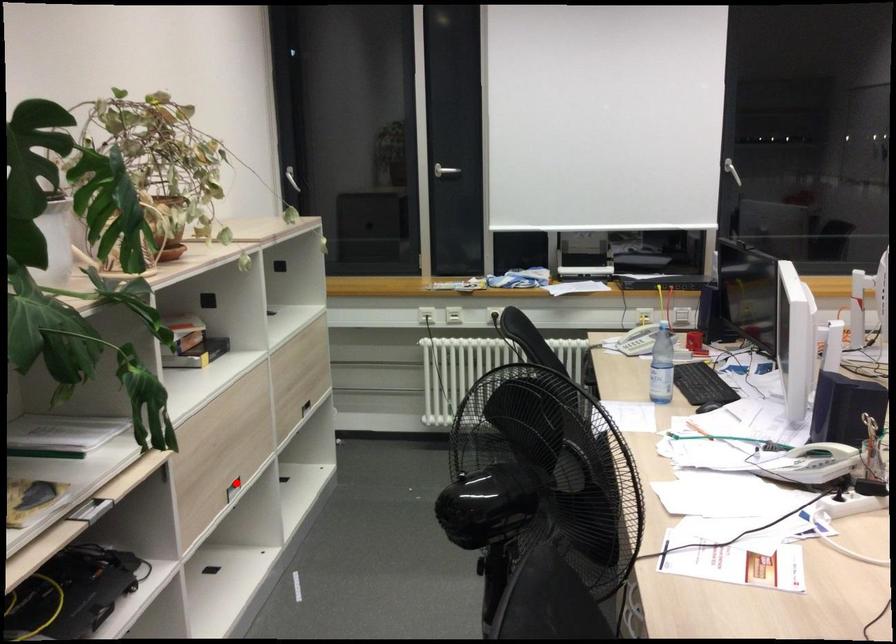
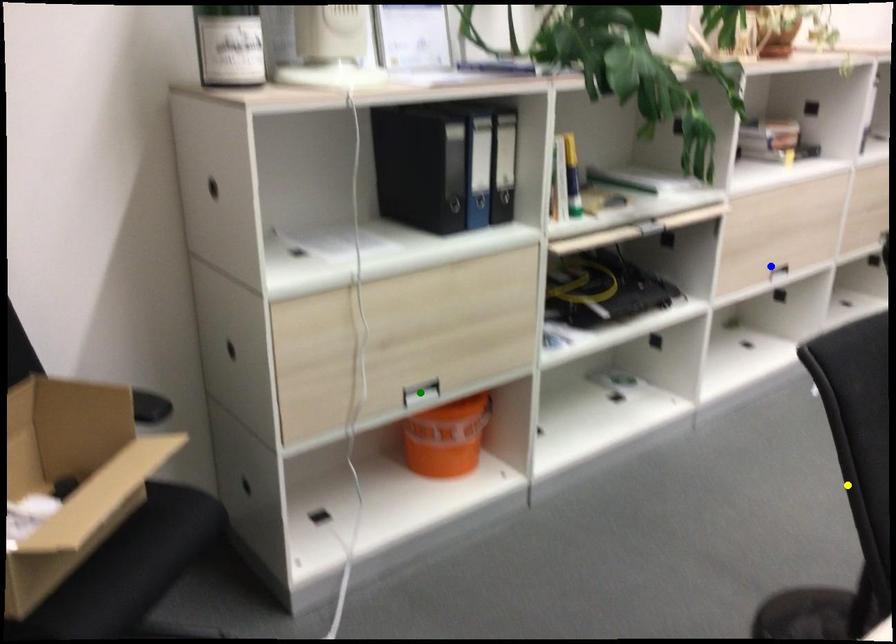
Question: I am providing you with two images of the same scene from different viewpoints. A red point is marked on the first image. You are given multiple points on the second image. Which point in image 2 represents the same 3d spot as the red point in image 1?

Choices:
 (A) green point
 (B) blue point
 (C) yellow point

Answer: (B)